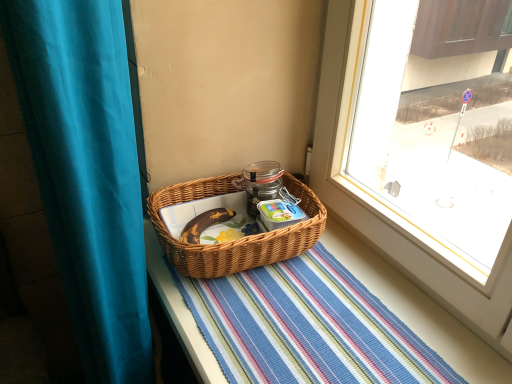
This screenshot has height=384, width=512. I want to click on empty space that is to the right of woven brown picnic basket at center, so click(x=359, y=285).